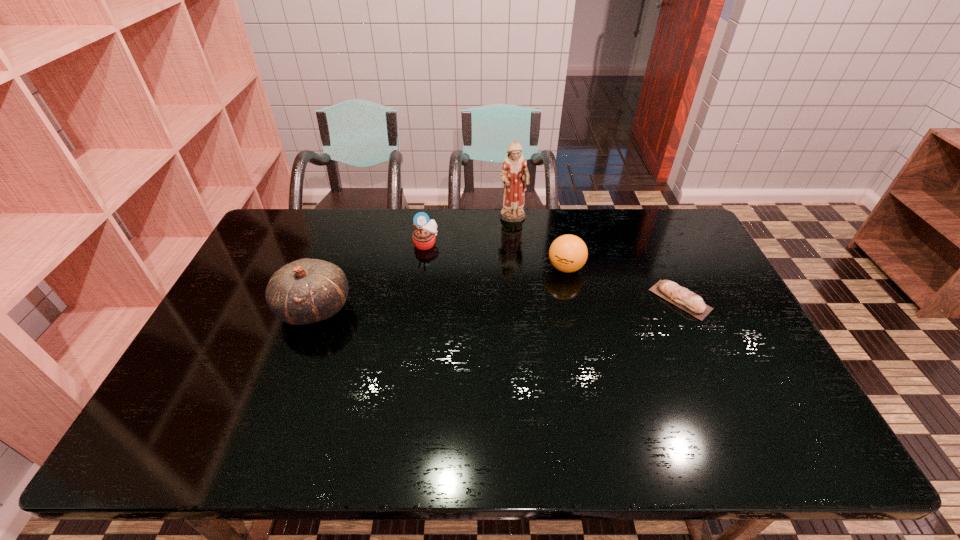
Identify the location of free space on the desktop that is between the gourd and the rightmost object and is positioned on the side with brand of the second object from right to left. (522, 303).

I want to click on free space on the desktop that is between the leftmost object and the rightmost object and is positioned on the front-facing side of the muffin, so click(x=468, y=305).

Find the location of `vacant space on the desktop that is between the leftmost object and the rightmost object and is positioned on the front-facing side of the figurine`. vacant space on the desktop that is between the leftmost object and the rightmost object and is positioned on the front-facing side of the figurine is located at coordinates (550, 303).